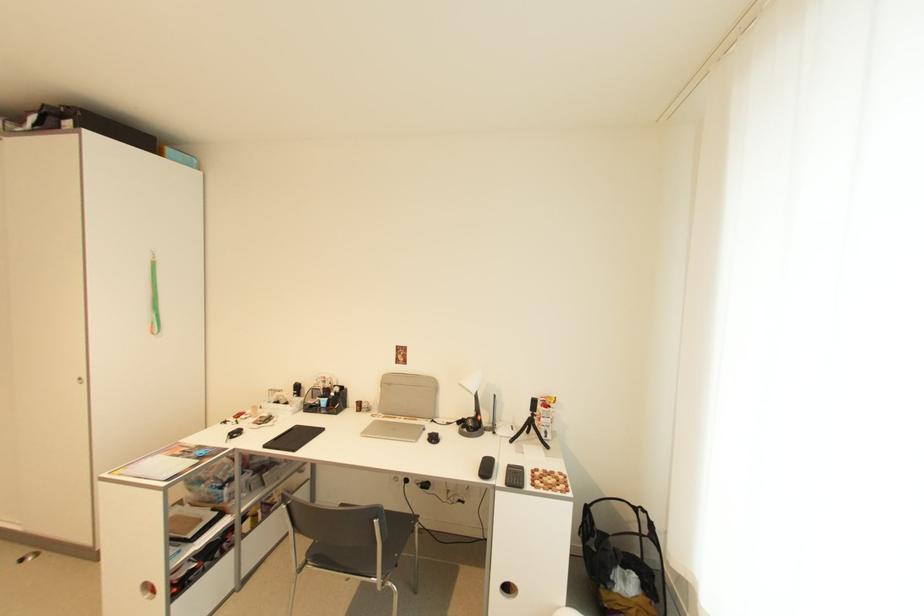
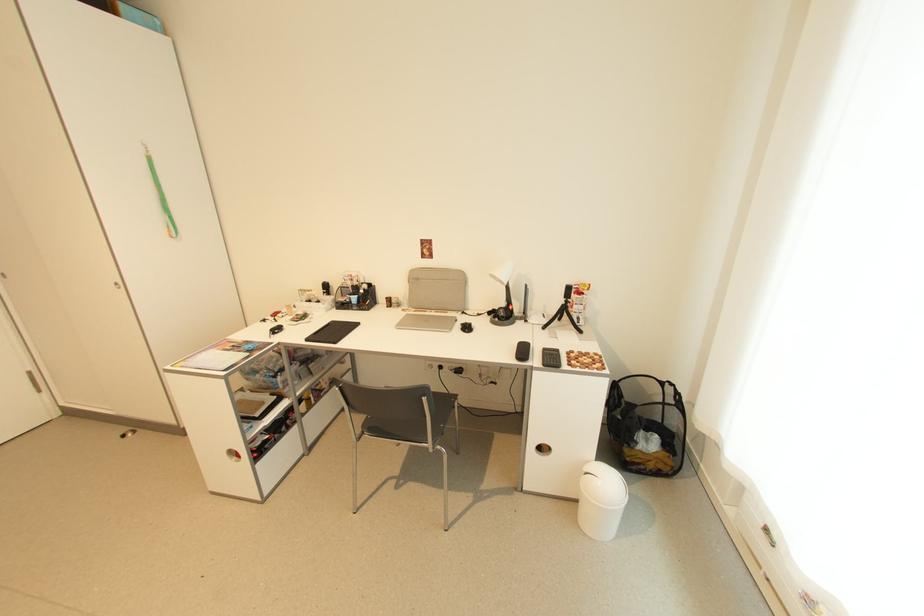
Find the pixel in the second image that matches (x=395, y=386) in the first image.

(422, 281)